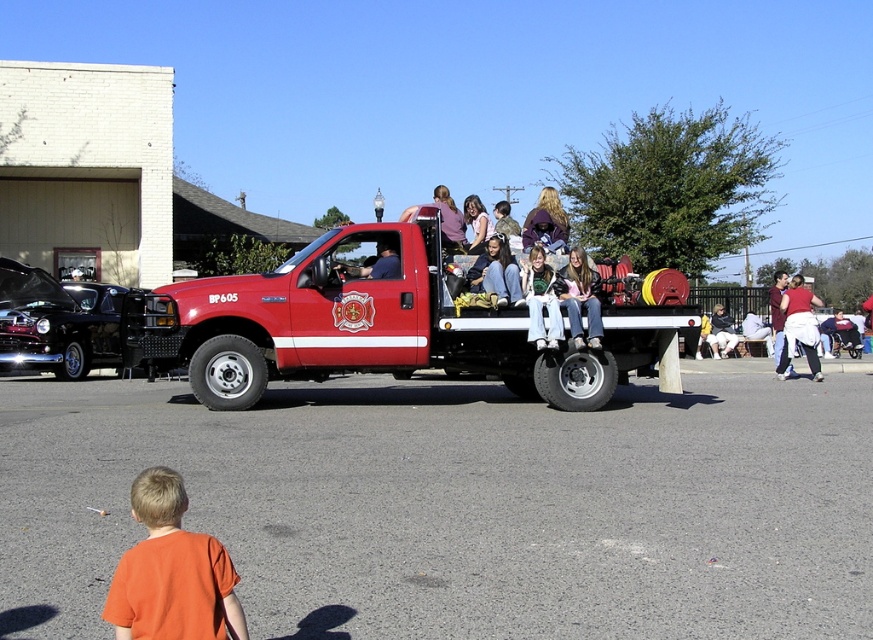
Question: Can you confirm if orange t-shirt at lower left is positioned below shiny black car at left?

Choices:
 (A) no
 (B) yes

Answer: (B)

Question: Which object is closer to the camera taking this photo?

Choices:
 (A) gray asphalt parking lot at lower center
 (B) matte white shirt at center
 (C) shiny red firetruck at center

Answer: (A)

Question: Is matte pink shirt at center further to the viewer compared to matte white shirt at center?

Choices:
 (A) no
 (B) yes

Answer: (A)

Question: Which of the following is the farthest from the observer?

Choices:
 (A) (31, 368)
 (B) (803, 301)
 (C) (581, 326)
 (D) (552, 394)

Answer: (B)

Question: Does gray asphalt parking lot at lower center appear on the right side of orange t-shirt at lower left?

Choices:
 (A) no
 (B) yes

Answer: (B)

Question: Which object appears farthest from the camera in this image?

Choices:
 (A) shiny red firetruck at center
 (B) shiny black car at left
 (C) matte white shirt at center

Answer: (C)